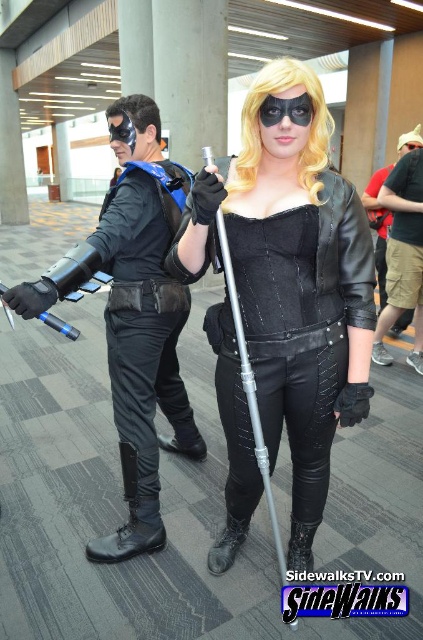
Question: Is black leather jacket at center closer to the viewer compared to black leather pants at center?

Choices:
 (A) yes
 (B) no

Answer: (A)

Question: Which of the following is the closest to the observer?

Choices:
 (A) black leather jacket at center
 (B) matte black armor at left

Answer: (A)

Question: Which is farther from the black leather pants at center?

Choices:
 (A) matte black armor at left
 (B) black leather jacket at center

Answer: (B)

Question: Can you confirm if matte black armor at left is positioned to the right of black leather pants at center?

Choices:
 (A) yes
 (B) no

Answer: (B)

Question: Considering the relative positions of matte black armor at left and black leather pants at center in the image provided, where is matte black armor at left located with respect to black leather pants at center?

Choices:
 (A) left
 (B) right

Answer: (A)

Question: Which point appears farthest from the camera in this image?

Choices:
 (A) (19, 308)
 (B) (389, 257)

Answer: (B)